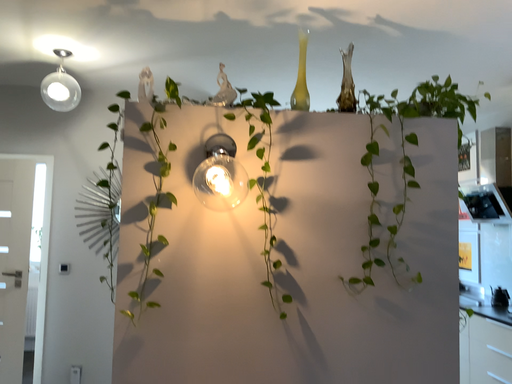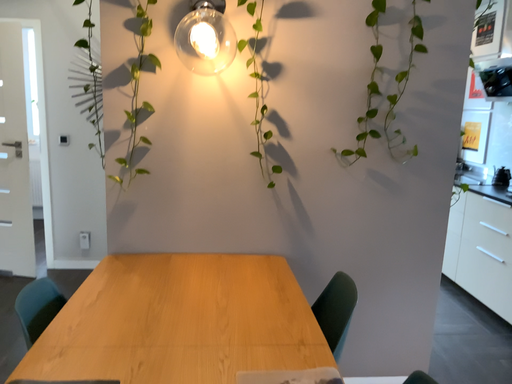
Question: Which way did the camera rotate in the video?

Choices:
 (A) rotated downward
 (B) rotated upward

Answer: (A)